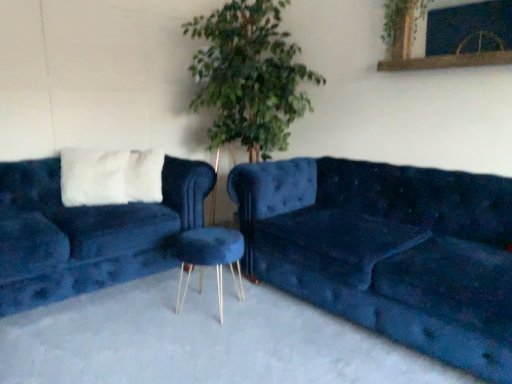
Locate an element on the screen. free spot below velvet blue stool at center (from a real-world perspective) is located at coordinates (209, 302).